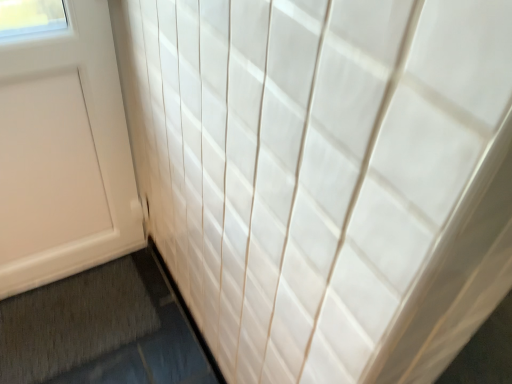
Question: From the image's perspective, relative to white matte door at left, is gray textured bath mat at lower left above or below?

Choices:
 (A) below
 (B) above

Answer: (A)

Question: Is gray textured bath mat at lower left inside or outside of white matte door at left?

Choices:
 (A) inside
 (B) outside

Answer: (B)

Question: Looking at their shapes, would you say gray textured bath mat at lower left is wider or thinner than white matte door at left?

Choices:
 (A) thin
 (B) wide

Answer: (B)

Question: In terms of width, does white matte door at left look wider or thinner when compared to gray textured bath mat at lower left?

Choices:
 (A) thin
 (B) wide

Answer: (A)

Question: Does point [90, 44] appear closer or farther from the camera than point [140, 261]?

Choices:
 (A) farther
 (B) closer

Answer: (B)

Question: From the image's perspective, is white matte door at left above or below gray textured bath mat at lower left?

Choices:
 (A) below
 (B) above

Answer: (B)

Question: In the image, is white matte door at left on the left side or the right side of gray textured bath mat at lower left?

Choices:
 (A) left
 (B) right

Answer: (A)